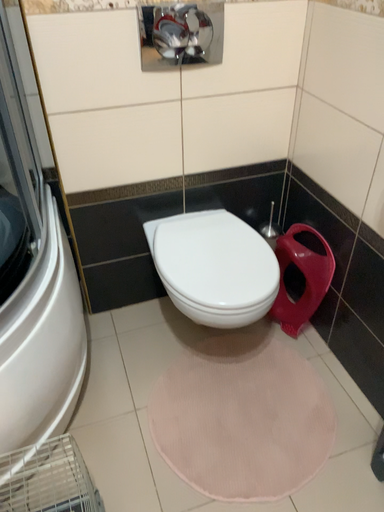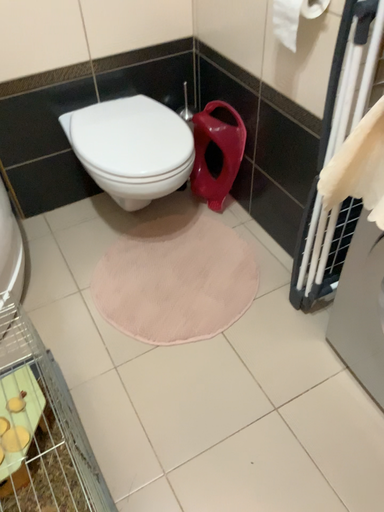
Question: Which way did the camera rotate in the video?

Choices:
 (A) rotated right
 (B) rotated left

Answer: (A)